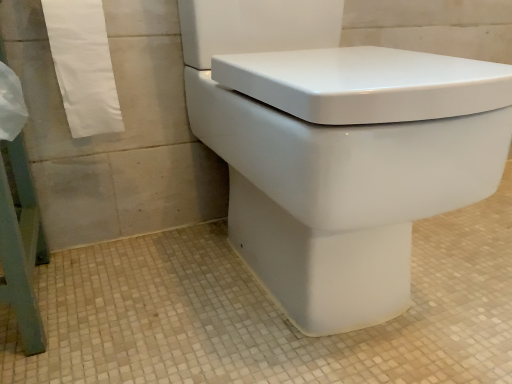
This screenshot has height=384, width=512. Identify the location of free location to the left of white glossy toilet at center. (142, 290).